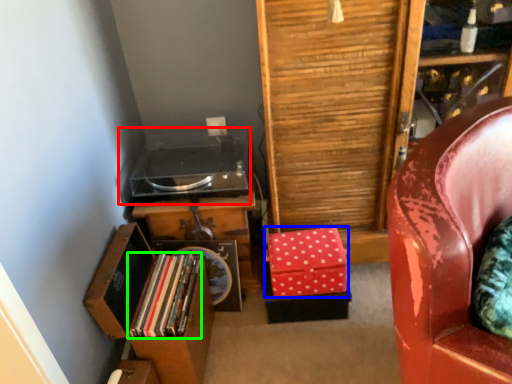
Question: Which object is positioned farthest from stereo (highlighted by a red box)? Select from box (highlighted by a blue box) and book (highlighted by a green box).

Choices:
 (A) box
 (B) book

Answer: (A)